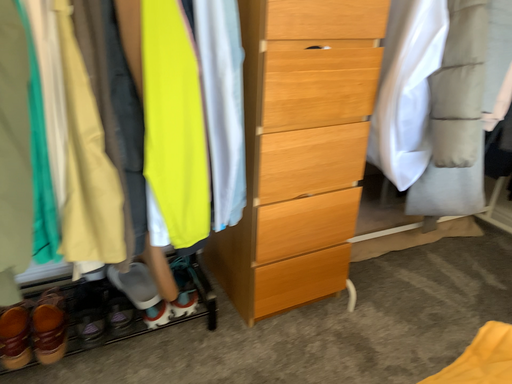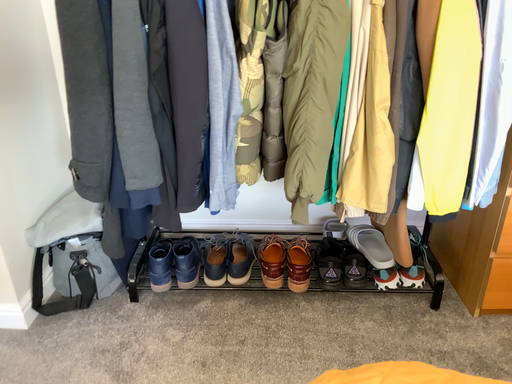
Question: How did the camera likely rotate when shooting the video?

Choices:
 (A) rotated left
 (B) rotated right

Answer: (A)